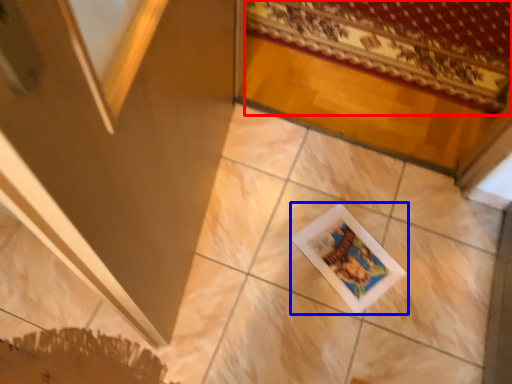
Question: Which of the following is the farthest to the observer, mat (highlighted by a red box) or picture frame (highlighted by a blue box)?

Choices:
 (A) mat
 (B) picture frame

Answer: (A)